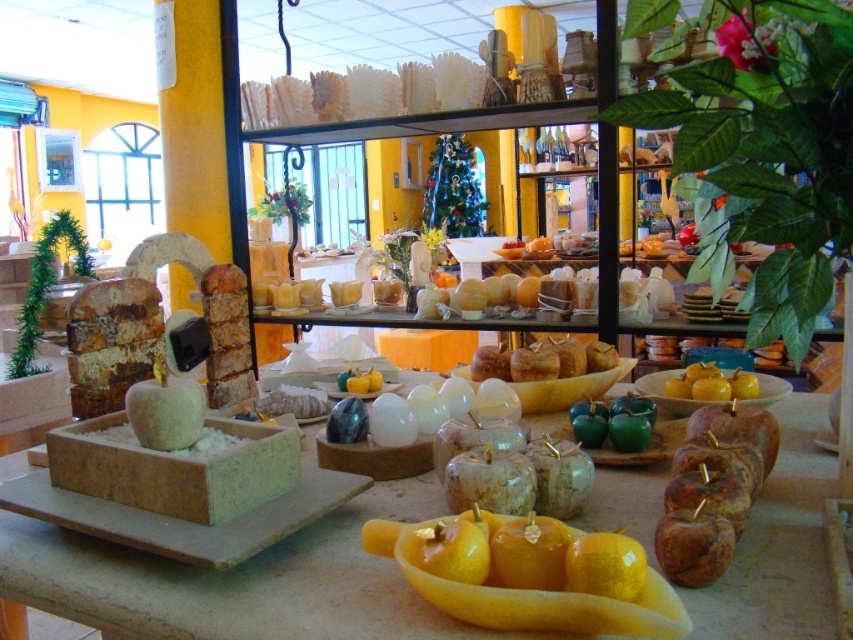
Does matte stone bowl at center appear under yellow wax candle at center?

Yes.

Is point (724, 605) positioned behind point (677, 625)?

Yes, it is behind point (677, 625).

Locate an element on the screen. The image size is (853, 640). matte stone bowl at center is located at coordinates (236, 580).

Who is taller, yellow wax candle at center or yellow glossy apples at center?

Standing taller between the two is yellow wax candle at center.

Who is more distant from viewer, (459, 570) or (711, 397)?

The point (711, 397) is more distant.

Locate an element on the screen. Image resolution: width=853 pixels, height=640 pixels. yellow wax candle at center is located at coordinates (531, 573).

Is matte stone bowl at center closer to camera compared to yellow glossy apples at center?

Yes, it is.

Who is positioned more to the right, matte stone bowl at center or yellow glossy apples at center?

Positioned to the right is yellow glossy apples at center.

Does point (769, 520) come closer to viewer compared to point (704, 396)?

Yes, point (769, 520) is in front of point (704, 396).

This screenshot has width=853, height=640. What are the coordinates of `matte stone bowl at center` in the screenshot? It's located at (236, 580).